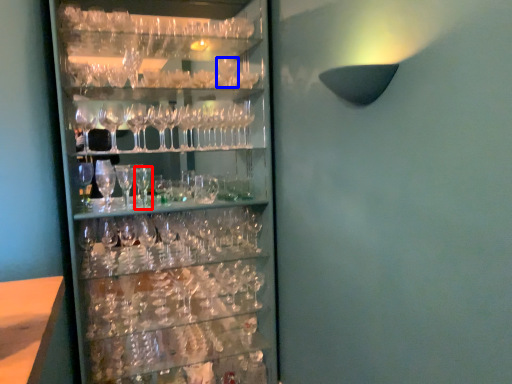
Question: Among these objects, which one is farthest to the camera, beer glass (highlighted by a red box) or wine glass (highlighted by a blue box)?

Choices:
 (A) beer glass
 (B) wine glass

Answer: (B)